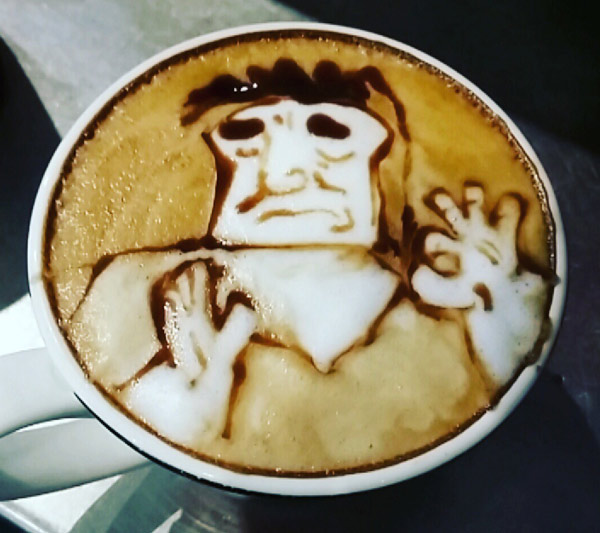
You are a GUI agent. You are given a task and a screenshot of the screen. Output one action in this format:
    pyautogui.click(x=<x>, y=<y>)
    Task: Click on the mug handle
    Image resolution: width=600 pixels, height=533 pixels.
    Given the screenshot: What is the action you would take?
    pyautogui.click(x=40, y=370), pyautogui.click(x=42, y=450)